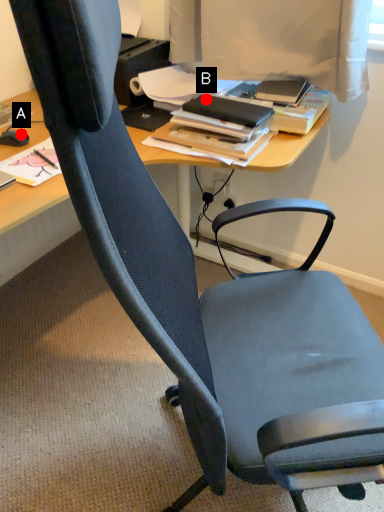
Question: Two points are circled on the image, labeled by A and B beside each circle. Which point is further to the camera?

Choices:
 (A) A is further
 (B) B is further

Answer: (A)